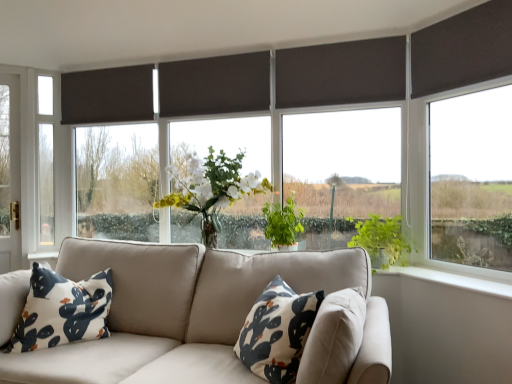
Question: Considering the relative sizes of matte glass window at center, the 3th window viewed from the right, and white fabric pillow at center, the first pillow when ordered from right to left, in the image provided, is matte glass window at center, the 3th window viewed from the right, thinner than white fabric pillow at center, the first pillow when ordered from right to left,?

Choices:
 (A) yes
 (B) no

Answer: (A)

Question: Can you confirm if matte glass window at center, the second window positioned from the left, is positioned to the right of white fabric pillow at center, the 2th pillow when ordered from left to right?

Choices:
 (A) no
 (B) yes

Answer: (A)

Question: Can you see matte glass window at center, which is the 2th window from back to front, touching white fabric pillow at center, the 2th pillow when ordered from left to right?

Choices:
 (A) yes
 (B) no

Answer: (B)

Question: Considering the relative sizes of matte glass window at center, which is the third window from front to back, and white fabric pillow at center, the first pillow when ordered from right to left, in the image provided, is matte glass window at center, which is the third window from front to back, shorter than white fabric pillow at center, the first pillow when ordered from right to left,?

Choices:
 (A) yes
 (B) no

Answer: (B)

Question: Is matte glass window at center, which is the 2th window from back to front, facing towards white fabric pillow at center, the first pillow when ordered from right to left?

Choices:
 (A) yes
 (B) no

Answer: (A)

Question: From a real-world perspective, is matte glass window at center, which is the 2th window from back to front, physically below white fabric pillow at center, the 2th pillow when ordered from left to right?

Choices:
 (A) yes
 (B) no

Answer: (B)

Question: Is matte black curtain at upper left, which is the second curtain from front to back, not close to green leafy tree at left?

Choices:
 (A) no
 (B) yes

Answer: (A)

Question: Is matte black curtain at upper left, the 1th curtain viewed from the left, located outside green leafy tree at left?

Choices:
 (A) no
 (B) yes

Answer: (B)

Question: Can you confirm if matte black curtain at upper left, marked as the first curtain in a back-to-front arrangement, is bigger than green leafy tree at left?

Choices:
 (A) yes
 (B) no

Answer: (A)

Question: Is green leafy tree at left completely or partially inside matte black curtain at upper left, marked as the first curtain in a back-to-front arrangement?

Choices:
 (A) yes
 (B) no

Answer: (B)

Question: Is the depth of matte black curtain at upper left, marked as the first curtain in a back-to-front arrangement, greater than that of green leafy tree at left?

Choices:
 (A) no
 (B) yes

Answer: (A)

Question: Can you confirm if matte black curtain at upper left, which is the second curtain from front to back, is positioned to the right of green leafy tree at left?

Choices:
 (A) yes
 (B) no

Answer: (A)

Question: Does dark matte blind at center, the second window when ordered from front to back, turn towards dark brown fabric blind at upper right?

Choices:
 (A) yes
 (B) no

Answer: (B)